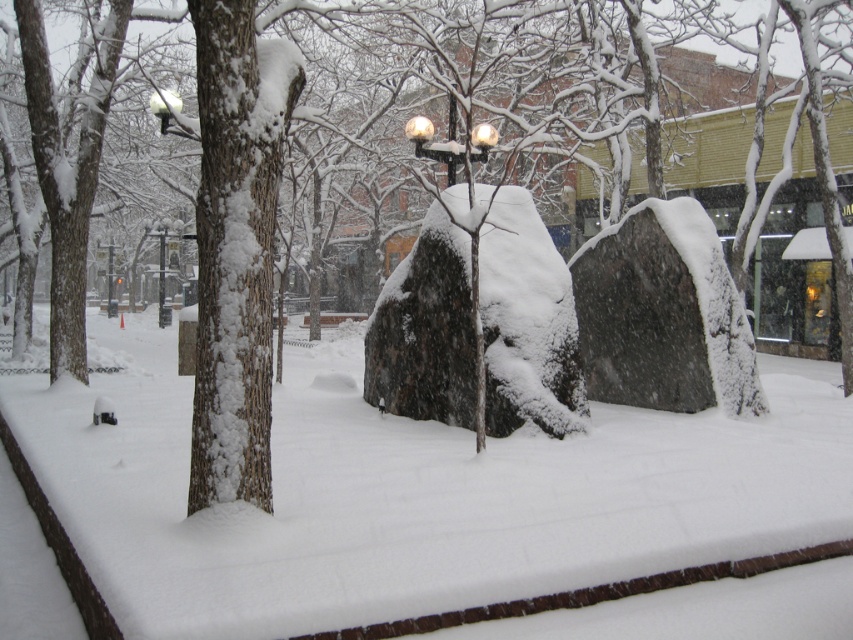
You are a city planner assessing the space between the white fluffy snow at center and the satin black lamp post at center. Based on the scene, can you determine if the snow area is wider than the lamp post?

The white fluffy snow at center is wider than the satin black lamp post at center according to the description.

You are a delivery person trying to find the entrance to a building. You see the white fluffy snow at center and the satin black lamp post at center. Which object is closer to the right side of the path leading to the entrance?

The white fluffy snow at center is to the right of the satin black lamp post at center, so the white fluffy snow at center is closer to the right side of the path leading to the entrance.